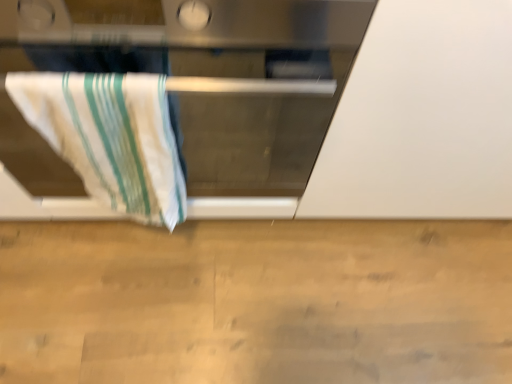
Question: From the image's perspective, is white matte oven at upper left located above or below white cotton towel at left?

Choices:
 (A) above
 (B) below

Answer: (A)

Question: Considering the positions of white matte oven at upper left and white cotton towel at left in the image, is white matte oven at upper left wider or thinner than white cotton towel at left?

Choices:
 (A) wide
 (B) thin

Answer: (A)

Question: Does point (282, 162) appear closer or farther from the camera than point (121, 137)?

Choices:
 (A) farther
 (B) closer

Answer: (A)

Question: Is white cotton towel at left in front of or behind white matte oven at upper left in the image?

Choices:
 (A) front
 (B) behind

Answer: (B)

Question: In terms of width, does white cotton towel at left look wider or thinner when compared to white matte oven at upper left?

Choices:
 (A) wide
 (B) thin

Answer: (B)

Question: From their relative heights in the image, would you say white cotton towel at left is taller or shorter than white matte oven at upper left?

Choices:
 (A) short
 (B) tall

Answer: (A)

Question: Do you think white cotton towel at left is within white matte oven at upper left, or outside of it?

Choices:
 (A) outside
 (B) inside

Answer: (B)